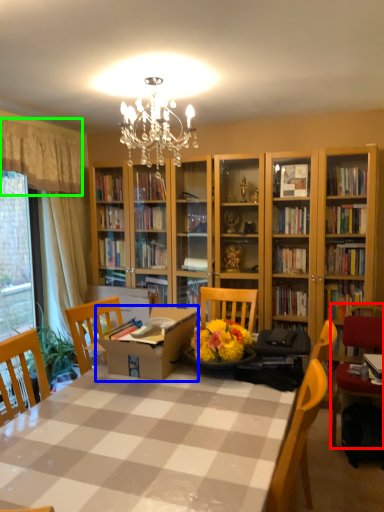
Question: Which is farther away from chair (highlighted by a red box)? cardboard box (highlighted by a blue box) or curtain (highlighted by a green box)?

Choices:
 (A) cardboard box
 (B) curtain

Answer: (B)